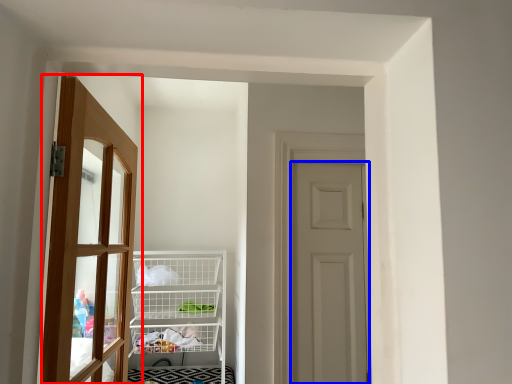
Question: Which object is further to the camera taking this photo, door (highlighted by a red box) or door (highlighted by a blue box)?

Choices:
 (A) door
 (B) door

Answer: (B)